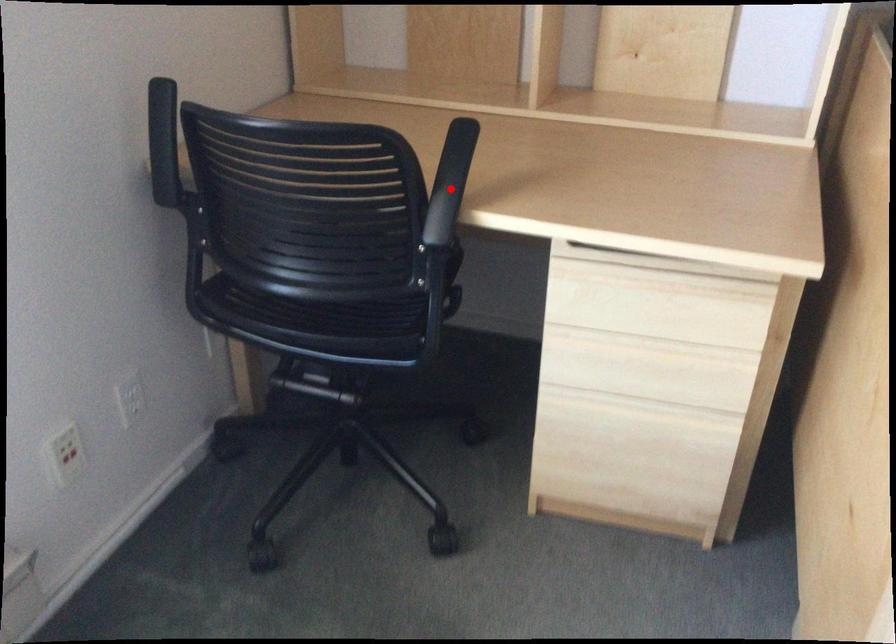
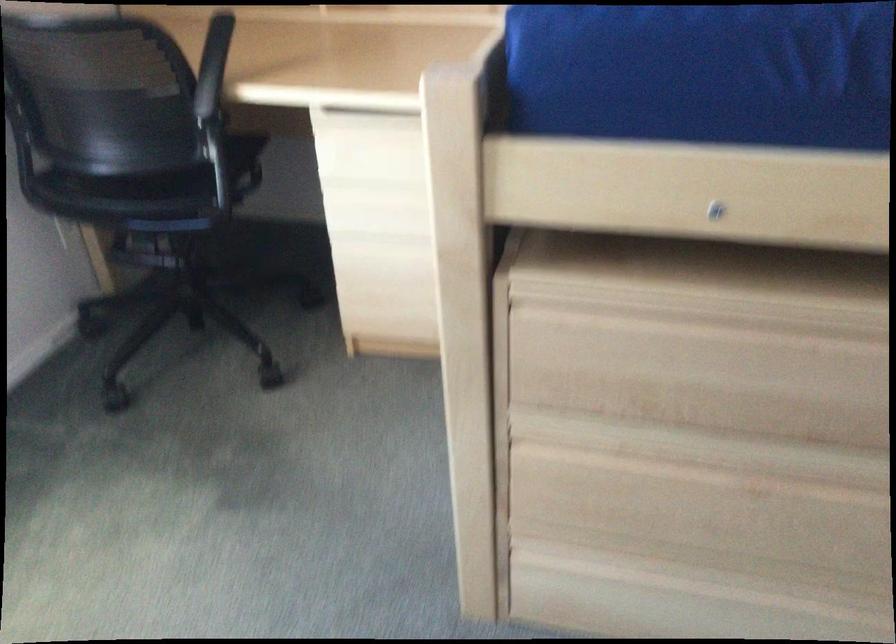
Question: I am providing you with two images of the same scene from different viewpoints. A red point is shown in image1. For the corresponding object point in image2, is it positioned nearer or farther from the camera?

Choices:
 (A) Nearer
 (B) Farther

Answer: (B)